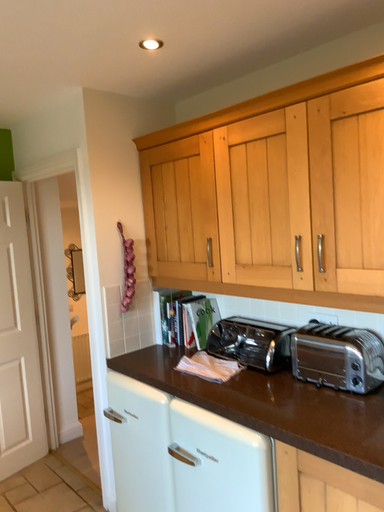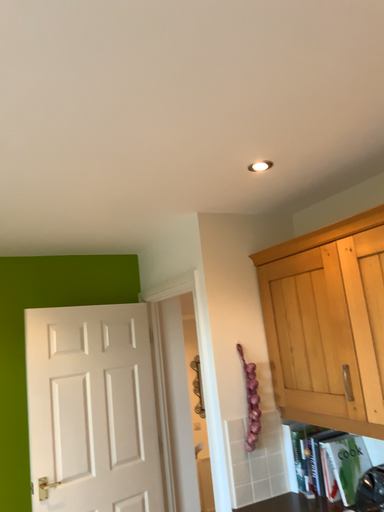
Question: Which way did the camera rotate in the video?

Choices:
 (A) rotated right
 (B) rotated left

Answer: (B)